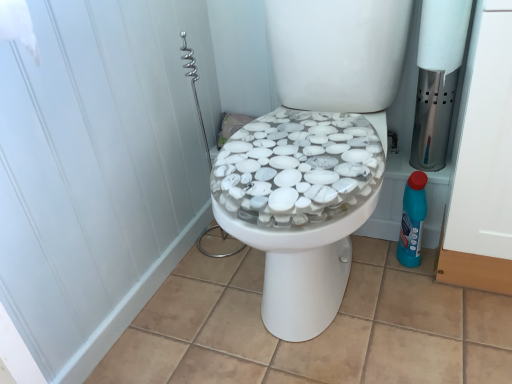
Identify the location of free space in front of white matte screen door at upper left. (192, 322).